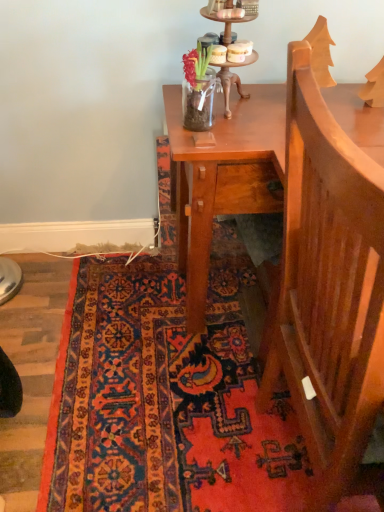
Question: Is wooden armchair at right bigger than carpet with intricate patterns at lower center?

Choices:
 (A) no
 (B) yes

Answer: (B)

Question: From the image's perspective, is wooden armchair at right on top of carpet with intricate patterns at lower center?

Choices:
 (A) yes
 (B) no

Answer: (A)

Question: Considering the relative sizes of wooden armchair at right and carpet with intricate patterns at lower center in the image provided, is wooden armchair at right smaller than carpet with intricate patterns at lower center?

Choices:
 (A) no
 (B) yes

Answer: (A)

Question: Is wooden armchair at right looking in the opposite direction of carpet with intricate patterns at lower center?

Choices:
 (A) no
 (B) yes

Answer: (A)

Question: Can you confirm if wooden armchair at right is taller than carpet with intricate patterns at lower center?

Choices:
 (A) no
 (B) yes

Answer: (B)

Question: Is wooden candle holder at upper center inside or outside of wooden armchair at right?

Choices:
 (A) outside
 (B) inside

Answer: (A)

Question: Is wooden candle holder at upper center taller or shorter than wooden armchair at right?

Choices:
 (A) short
 (B) tall

Answer: (A)

Question: In terms of width, does wooden candle holder at upper center look wider or thinner when compared to wooden armchair at right?

Choices:
 (A) thin
 (B) wide

Answer: (A)

Question: In the image, is wooden candle holder at upper center on the left side or the right side of wooden armchair at right?

Choices:
 (A) right
 (B) left

Answer: (B)

Question: Based on their positions, is carpet with intricate patterns at lower center located to the left or right of wooden armchair at right?

Choices:
 (A) left
 (B) right

Answer: (A)

Question: Which is correct: carpet with intricate patterns at lower center is inside wooden armchair at right, or outside of it?

Choices:
 (A) outside
 (B) inside

Answer: (A)

Question: In terms of size, does carpet with intricate patterns at lower center appear bigger or smaller than wooden armchair at right?

Choices:
 (A) small
 (B) big

Answer: (A)

Question: Is carpet with intricate patterns at lower center wider or thinner than wooden armchair at right?

Choices:
 (A) wide
 (B) thin

Answer: (A)

Question: In terms of height, does wooden armchair at right look taller or shorter compared to carpet with intricate patterns at lower center?

Choices:
 (A) short
 (B) tall

Answer: (B)

Question: Considering the positions of point tap(374, 268) and point tap(132, 265), is point tap(374, 268) closer or farther from the camera than point tap(132, 265)?

Choices:
 (A) closer
 (B) farther

Answer: (A)